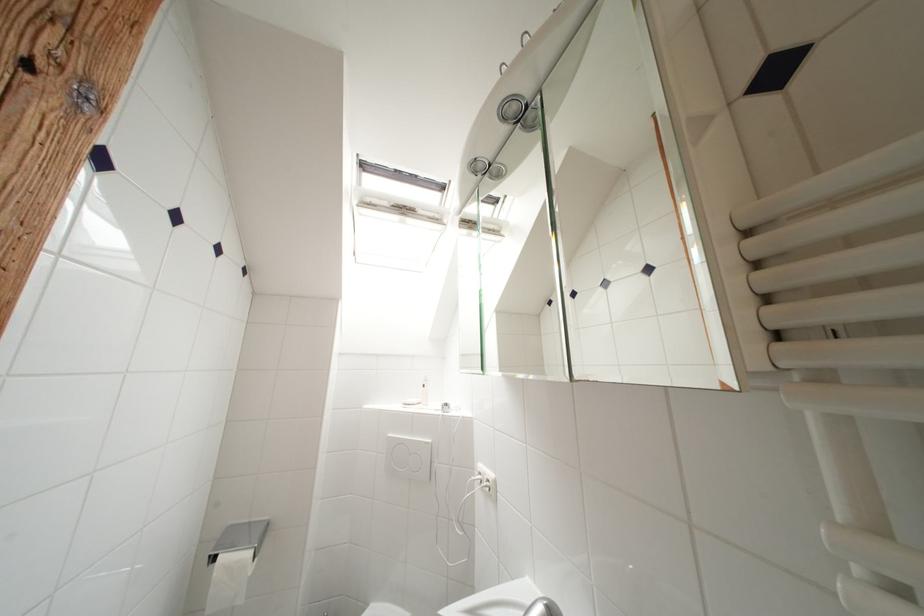
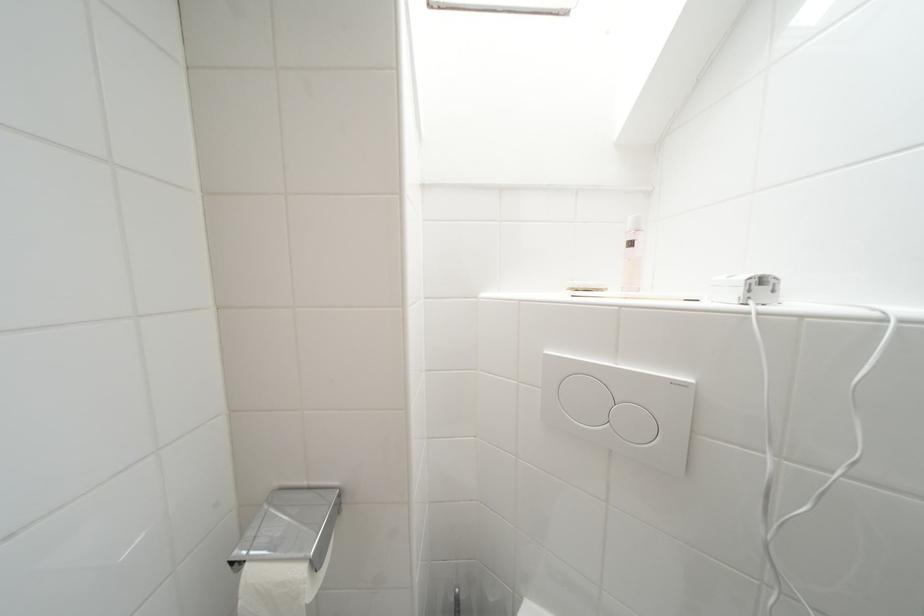
Locate, in the second image, the point that corresponds to pixel 431 389 in the first image.

(638, 246)